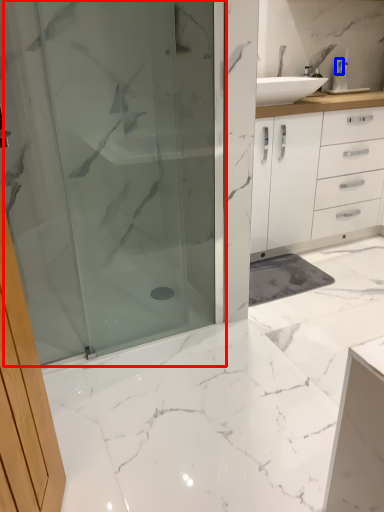
Question: Which object appears farthest to the camera in this image, shower door (highlighted by a red box) or toiletry (highlighted by a blue box)?

Choices:
 (A) shower door
 (B) toiletry

Answer: (B)